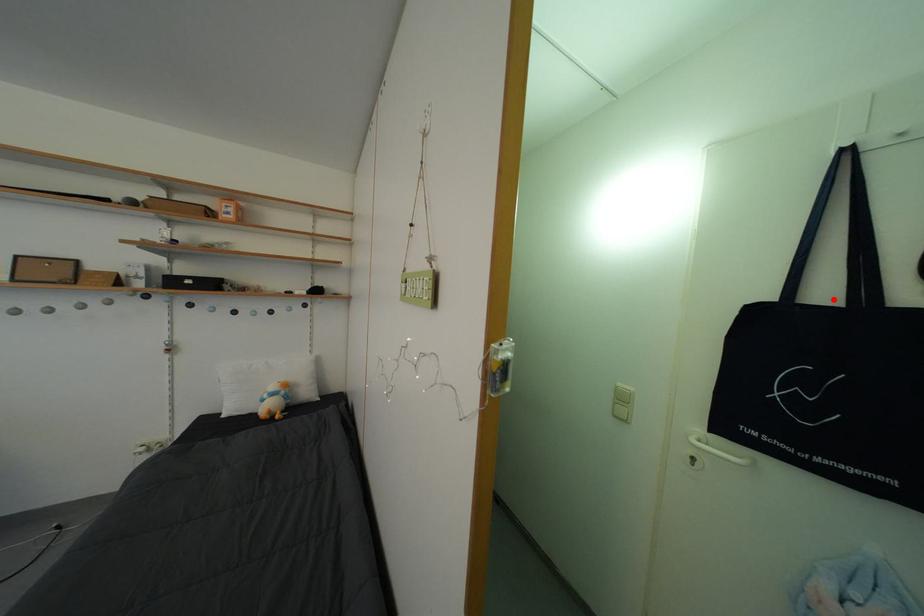
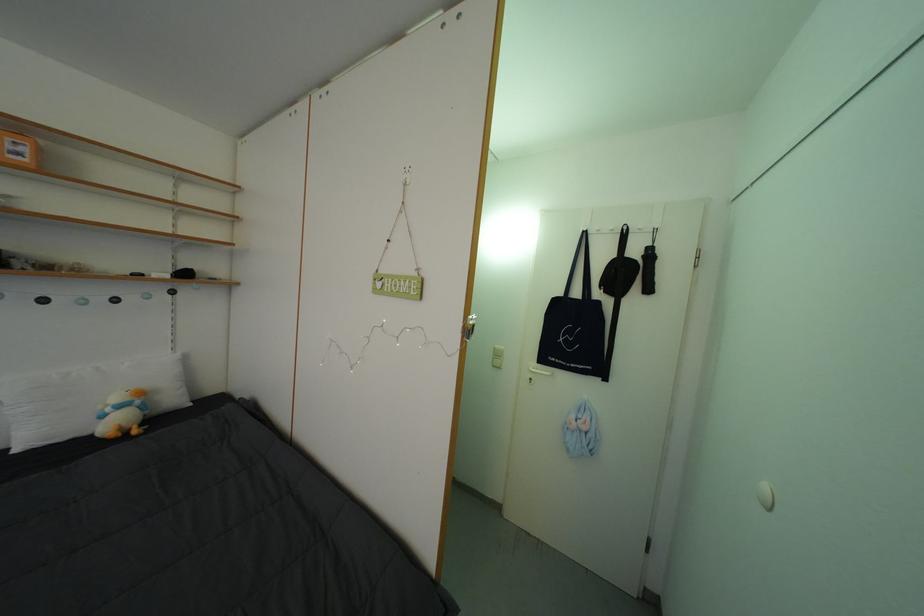
Find the pixel in the second image that matches the highlighted location in the first image.

(586, 300)